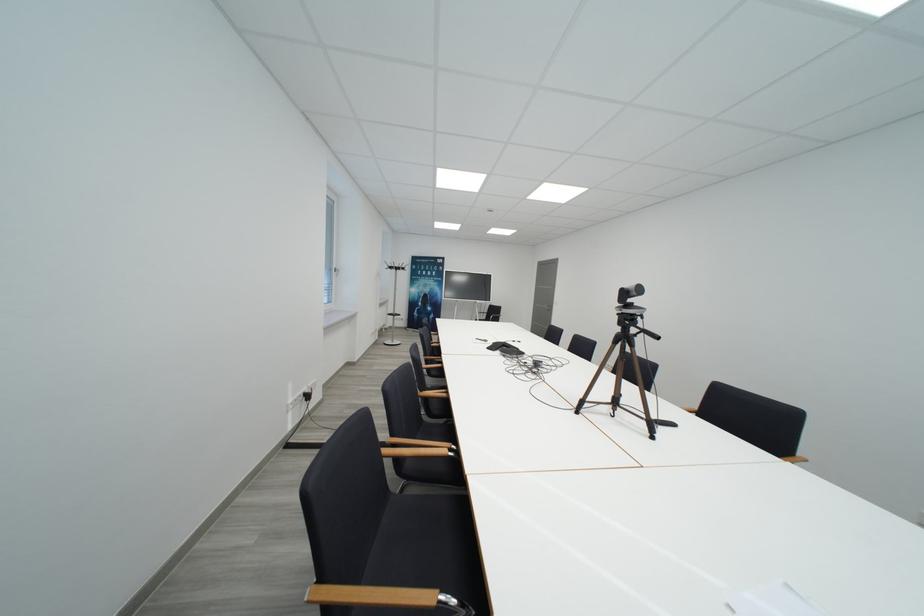
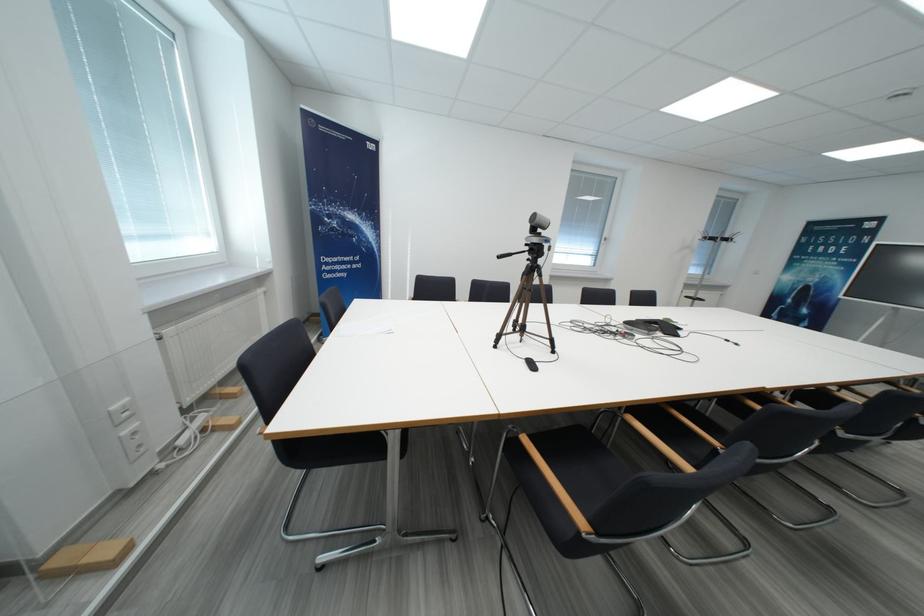
Question: I am providing you with two images of the same scene from different viewpoints. Which of the following objects are not visible in image2?

Choices:
 (A) wooden drawer pull
 (B) black chair sitting surface
 (C) camera on tripod
 (D) wooden chair armrest

Answer: (D)